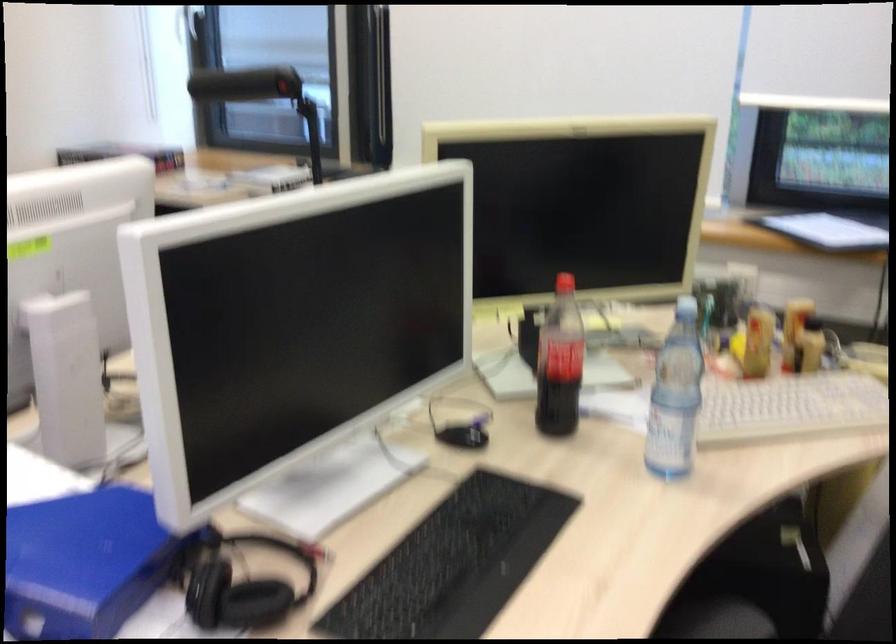
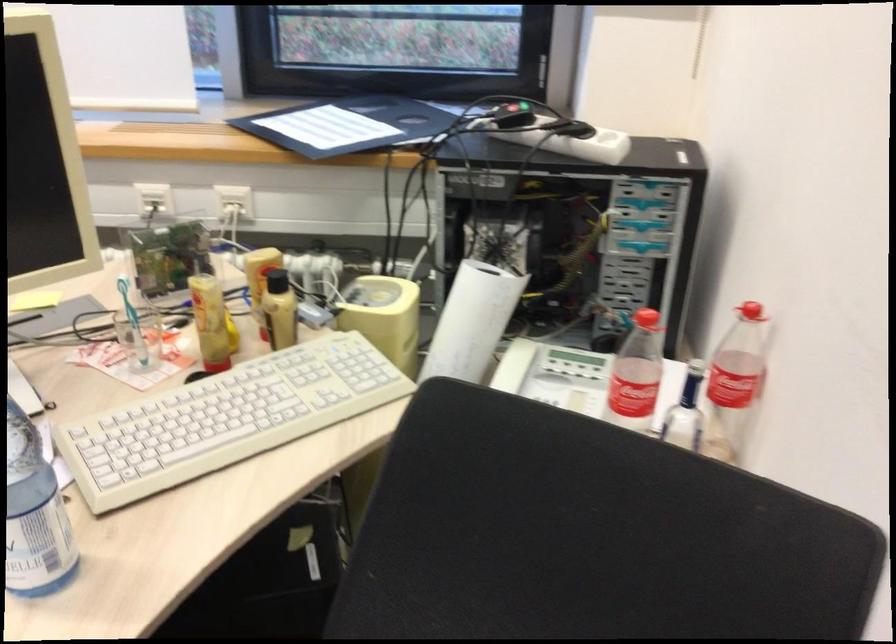
Question: The camera is either moving clockwise (left) or counter-clockwise (right) around the object. The first image is from the beginning of the video and the second image is from the end. Is the camera moving left or right when shooting the video?

Choices:
 (A) Left
 (B) Right

Answer: (A)